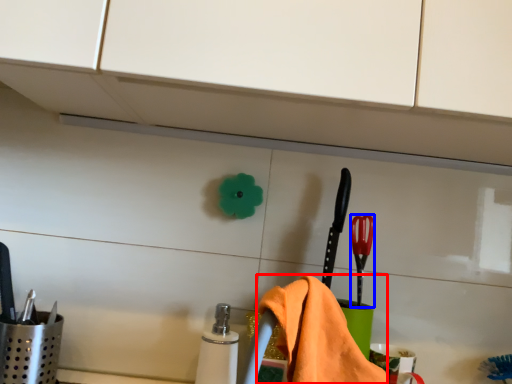
Question: Which object is further to the camera taking this photo, bath towel (highlighted by a red box) or brush (highlighted by a blue box)?

Choices:
 (A) bath towel
 (B) brush

Answer: (B)